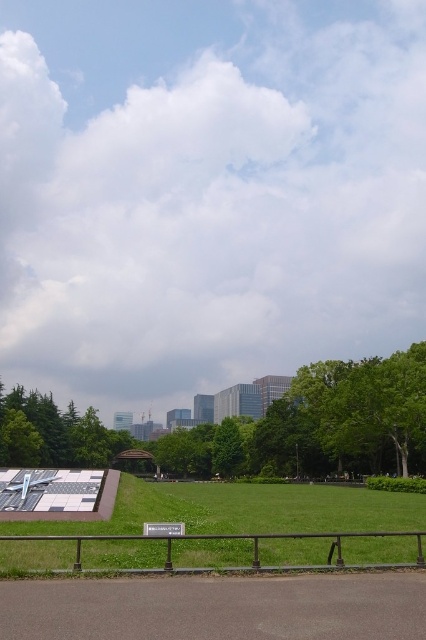
You are standing at the entrance of the park and want to reach the green grass at center. According to the coordinates provided, what direction should you move in to get there?

The green grass at center is located at coordinates point (250, 515), so you should move forward and towards the center of the park to reach it.

You are standing at the park entrance and see the green grass at center and the green leafy tree at center. Which object is nearer to you?

The green grass at center is closer to the viewer than the green leafy tree at center.

You are standing on the paved pathway with the metal railing. You see the green grass at center and the green leafy tree at center. Which object is positioned to the right side of the other?

The green grass at center is to the right of the green leafy tree at center.